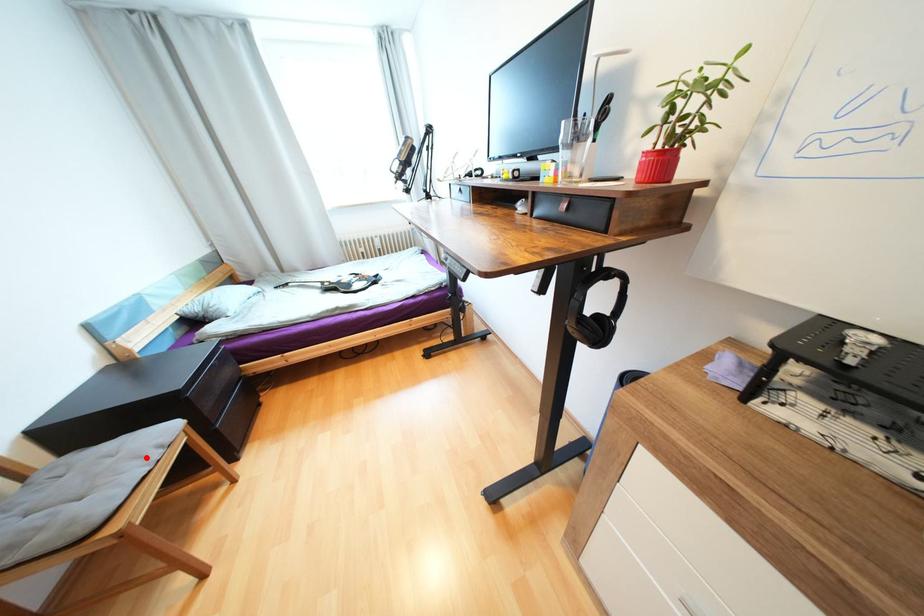
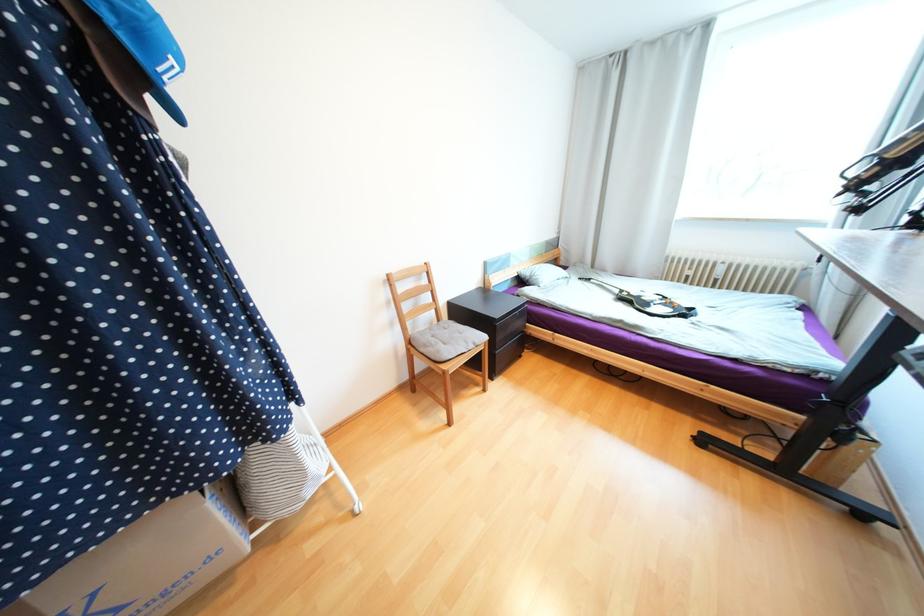
Locate, in the second image, the point that corresponds to the highlighted location in the first image.

(472, 342)